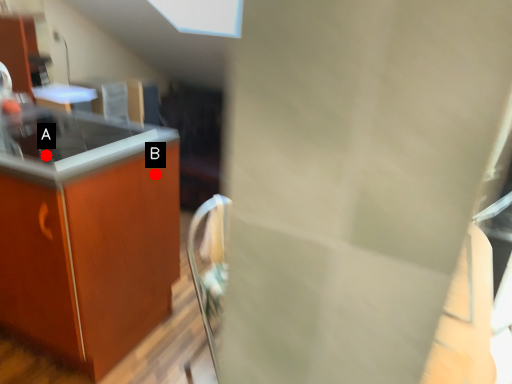
Question: Two points are circled on the image, labeled by A and B beside each circle. Which point appears closest to the camera in this image?

Choices:
 (A) A is closer
 (B) B is closer

Answer: (A)